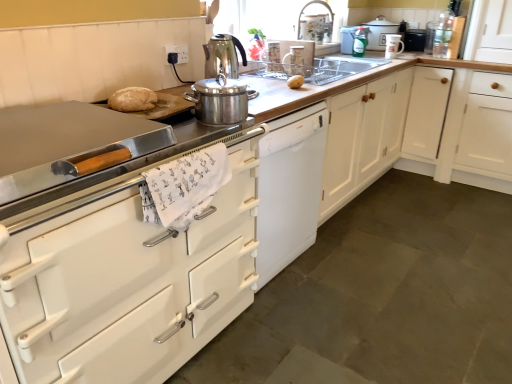
The width and height of the screenshot is (512, 384). I want to click on vacant area that lies between stainless steel kettle at center, the fifth kitchen appliance positioned from the back, and yellow matte potato at center, so click(x=266, y=82).